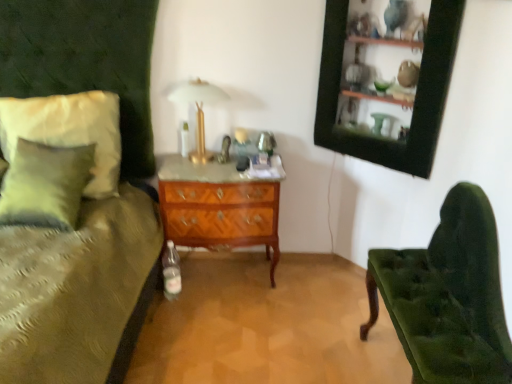
What are the coordinates of `vacant area that is in front of gold metallic table lamp at upper center` in the screenshot? It's located at (198, 170).